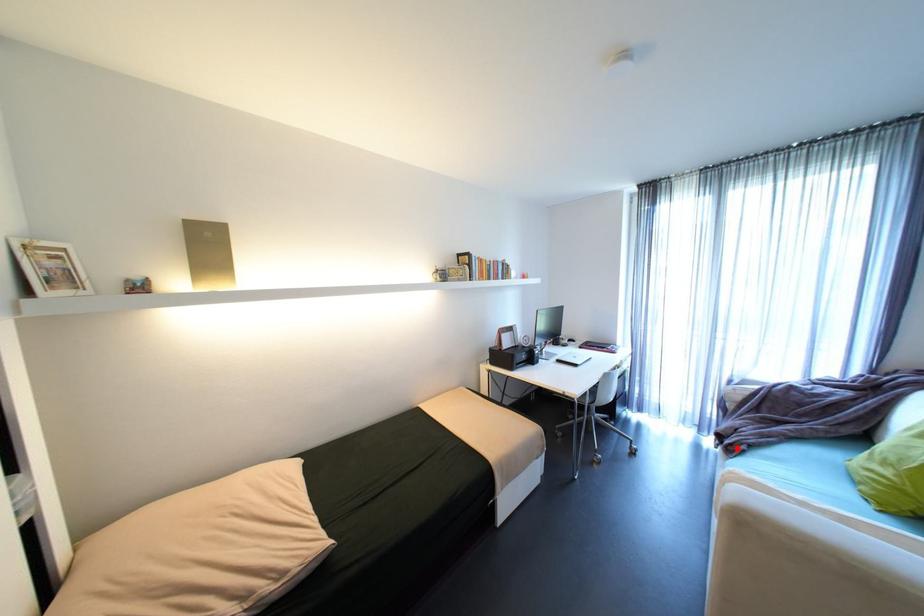
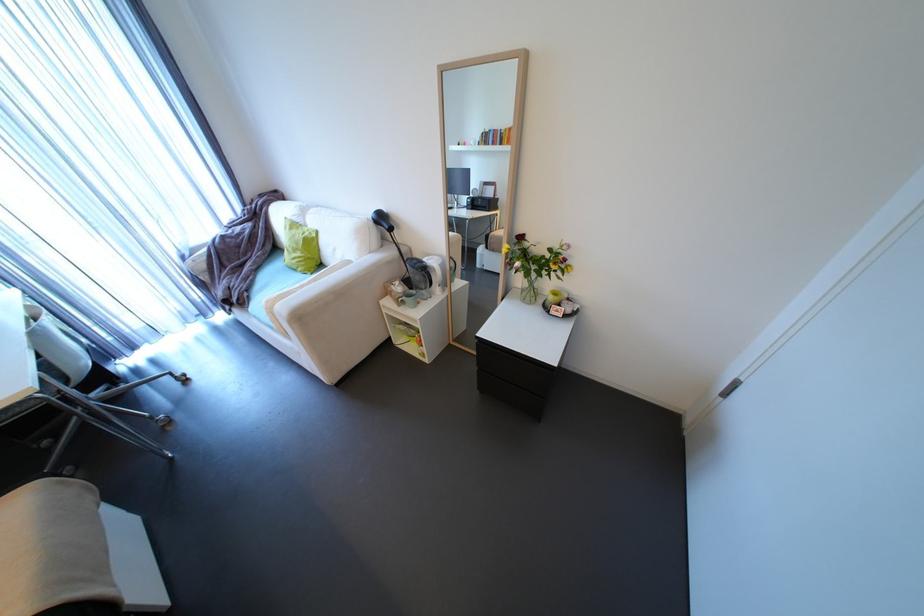
Question: I am providing you with two images of the same scene from different viewpoints. A red point is shown in image1. For the corresponding object point in image2, is it positioned nearer or farther from the camera?

Choices:
 (A) Nearer
 (B) Farther

Answer: (B)